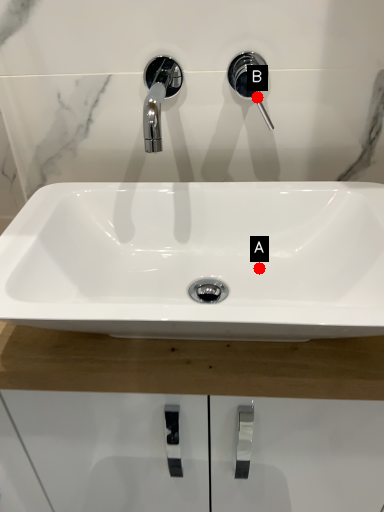
Question: Two points are circled on the image, labeled by A and B beside each circle. Which point is farther from the camera taking this photo?

Choices:
 (A) A is further
 (B) B is further

Answer: (B)